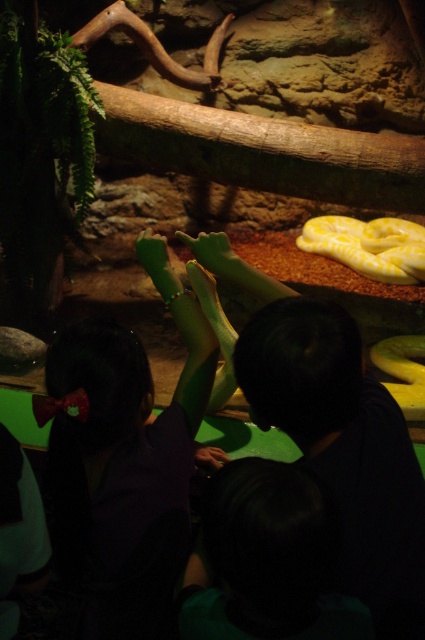
Who is more distant from viewer, (93, 483) or (419, 244)?

The point (419, 244) is behind.

Which is more to the right, dark purple shirt at center or yellow matte snake at upper center?

From the viewer's perspective, yellow matte snake at upper center appears more on the right side.

What do you see at coordinates (125, 461) in the screenshot? The image size is (425, 640). I see `dark purple shirt at center` at bounding box center [125, 461].

Locate an element on the screen. dark purple shirt at center is located at coordinates (125, 461).

Is yellow matte snake at upper center bigger than yellow matte snake at center?

Indeed, yellow matte snake at upper center has a larger size compared to yellow matte snake at center.

This screenshot has height=640, width=425. Describe the element at coordinates (368, 244) in the screenshot. I see `yellow matte snake at upper center` at that location.

Who is more forward, (396, 228) or (385, 385)?

Point (385, 385)

I want to click on yellow matte snake at upper center, so click(368, 244).

Which is above, dark purple shirt at center or yellow matte snake at center?

yellow matte snake at center is above.

Which is behind, point (183, 432) or point (388, 360)?

Positioned behind is point (388, 360).

Does point (74, 328) come closer to viewer compared to point (414, 385)?

Yes, it is in front of point (414, 385).

At what (x,y) coordinates should I click in order to perform the action: click on dark purple shirt at center. Please return your answer as a coordinate pair (x, y). Looking at the image, I should click on (125, 461).